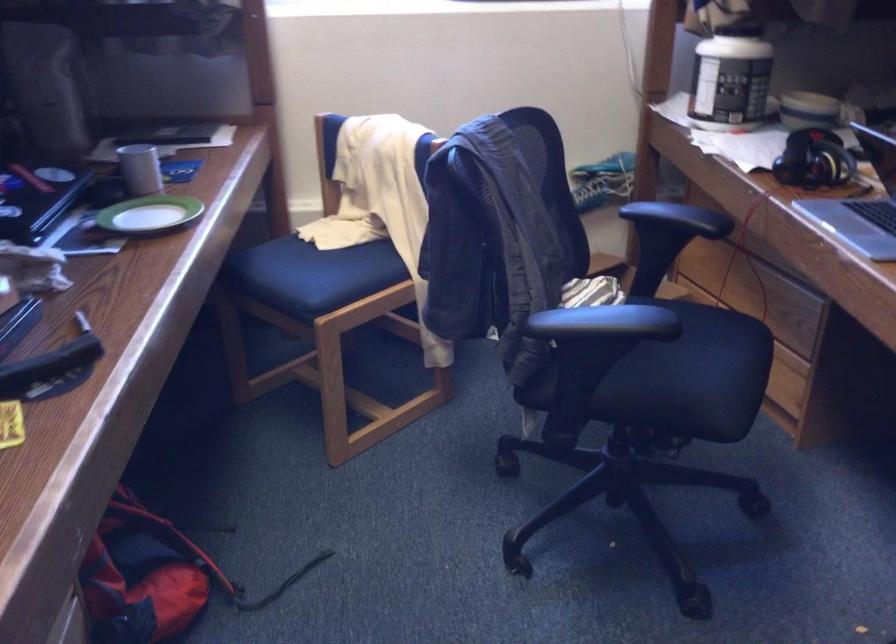
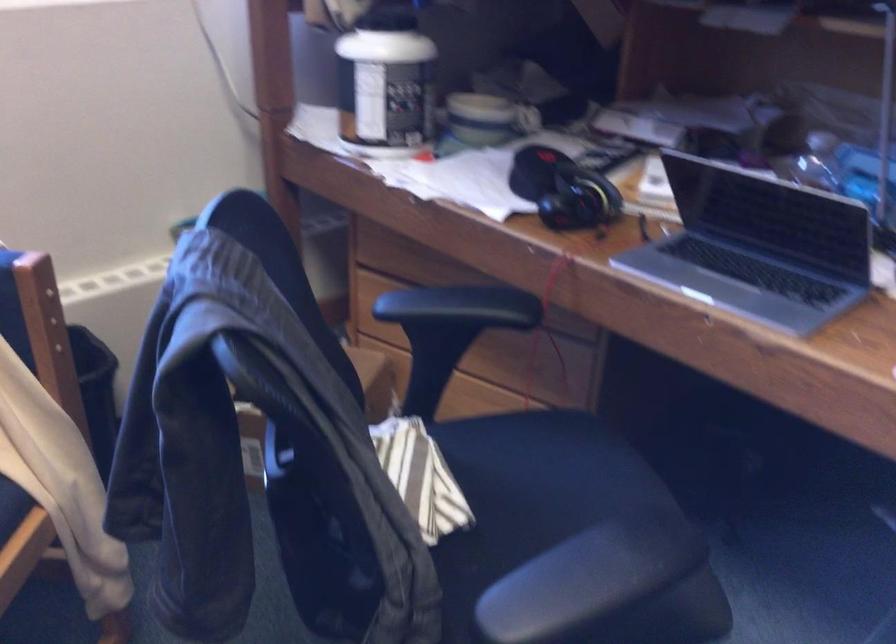
Question: The images are taken continuously from a first-person perspective. In which direction is your viewpoint rotating?

Choices:
 (A) Left
 (B) Right
 (C) Up
 (D) Down

Answer: (B)